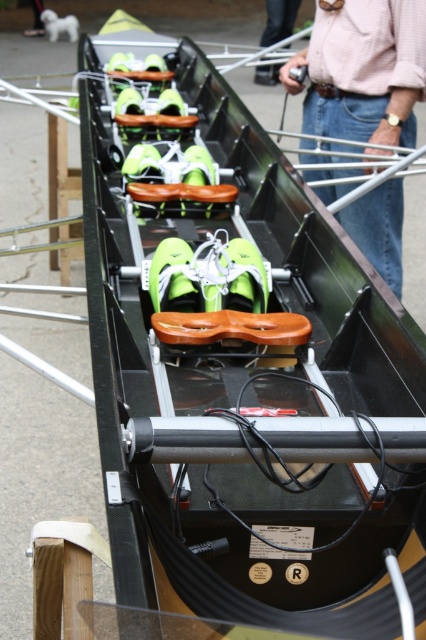
Between pink shirt at upper center and pink fabric shirt at upper center, which one has less height?

Answer: With less height is pink fabric shirt at upper center.

Is point (344, 208) behind point (267, 36)?

No, it is in front of (267, 36).

At what (x,y) coordinates should I click in order to perform the action: click on pink shirt at upper center. Please return your answer as a coordinate pair (x, y). Looking at the image, I should click on (362, 70).